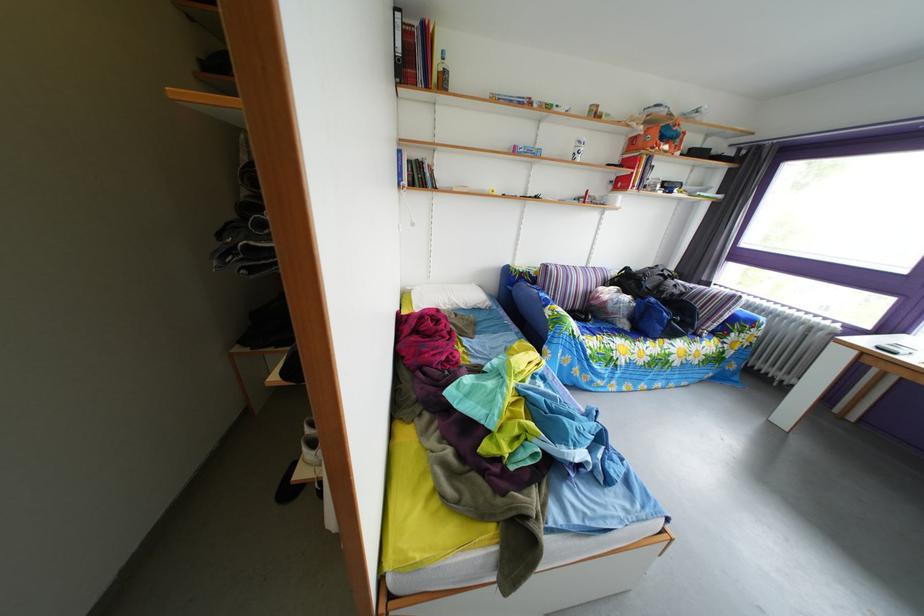
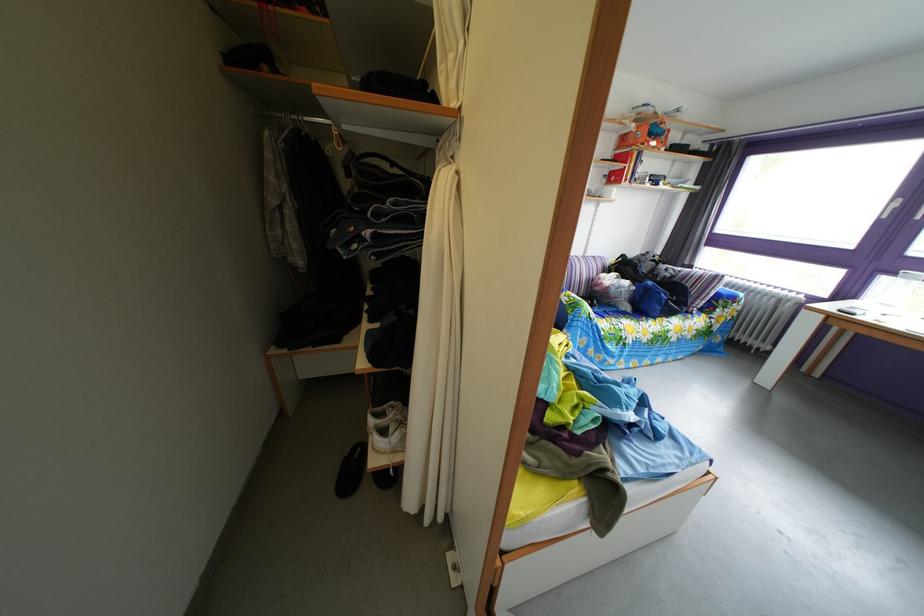
Locate, in the second image, the point that corresponds to (x=663, y=307) in the first image.

(661, 291)